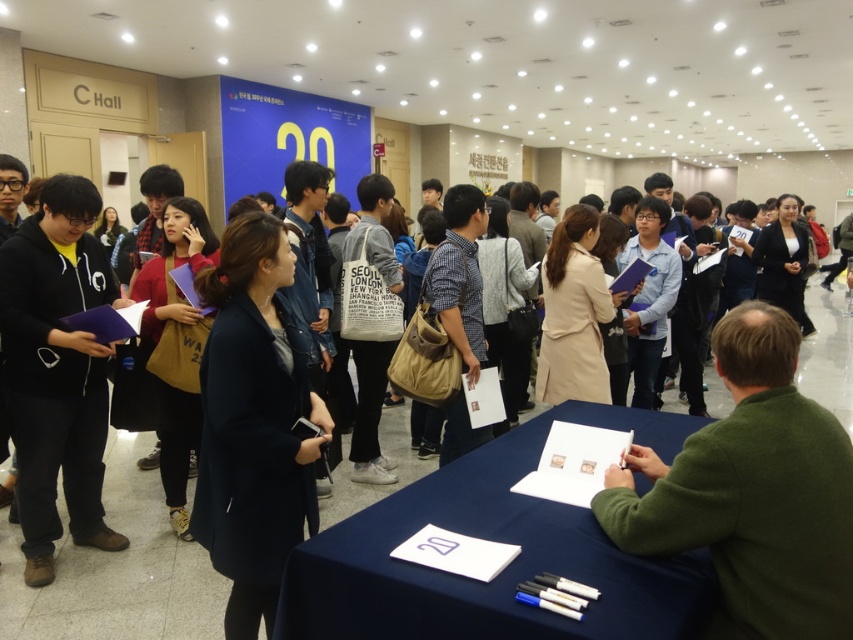
You are a guest at the event and want to approach the blue fabric table at lower center to sign a petition. However, there is a black matte hoodie at left blocking your path. Can you walk directly to the table without moving the hoodie?

The blue fabric table at lower center is positioned under the black matte hoodie at left, meaning the hoodie is above the table. Since the hoodie is not on the ground, it does not block the path. You can walk directly to the blue fabric table at lower center without moving the hoodie.

You are standing in the conference hall and see the blue fabric table at lower center and the black matte hoodie at left. Which object is nearer to you?

The blue fabric table at lower center is closer to the viewer than the black matte hoodie at left.